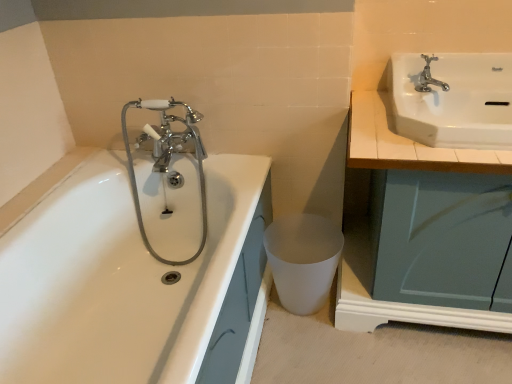
Image resolution: width=512 pixels, height=384 pixels. I want to click on vacant space to the right of chrome metallic faucet at upper right, so click(x=476, y=100).